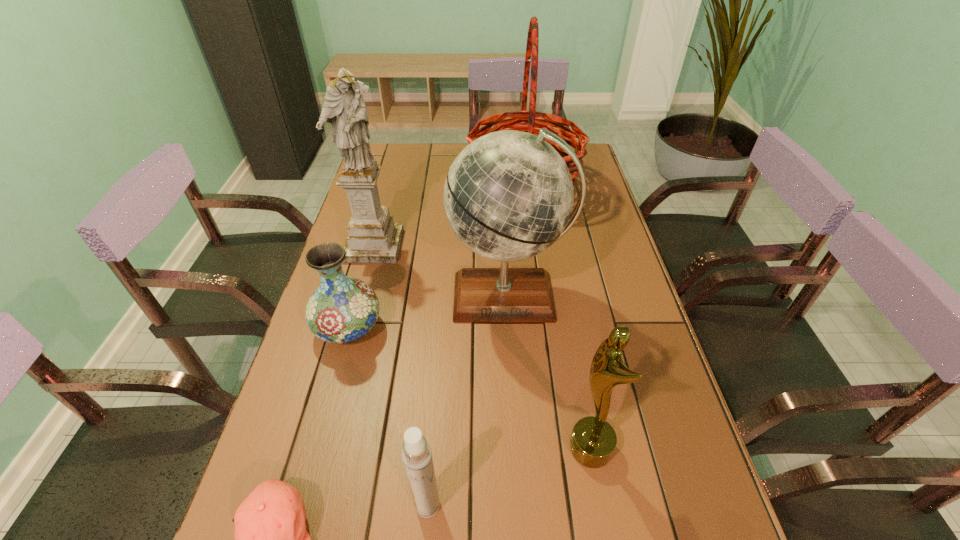
This screenshot has width=960, height=540. In order to click on unoccupied area between the aerosol can and the farthest object in this screenshot , I will do `click(476, 346)`.

Where is `object that is the fifth closest to the sculpture`? object that is the fifth closest to the sculpture is located at coordinates (593, 440).

Where is `object that is the fifth nearest to the vase`? The height and width of the screenshot is (540, 960). object that is the fifth nearest to the vase is located at coordinates (533, 124).

The image size is (960, 540). Find the location of `vacant space that satisfies the following two spatial constraints: 1. on the front-facing side of the fourth shortest object; 2. on the front side of the aerosol can`. vacant space that satisfies the following two spatial constraints: 1. on the front-facing side of the fourth shortest object; 2. on the front side of the aerosol can is located at coordinates (601, 505).

The image size is (960, 540). In order to click on vacant space that satisfies the following two spatial constraints: 1. on the handle side of the farthest object; 2. on the front-facing side of the sculpture in this screenshot , I will do `click(532, 246)`.